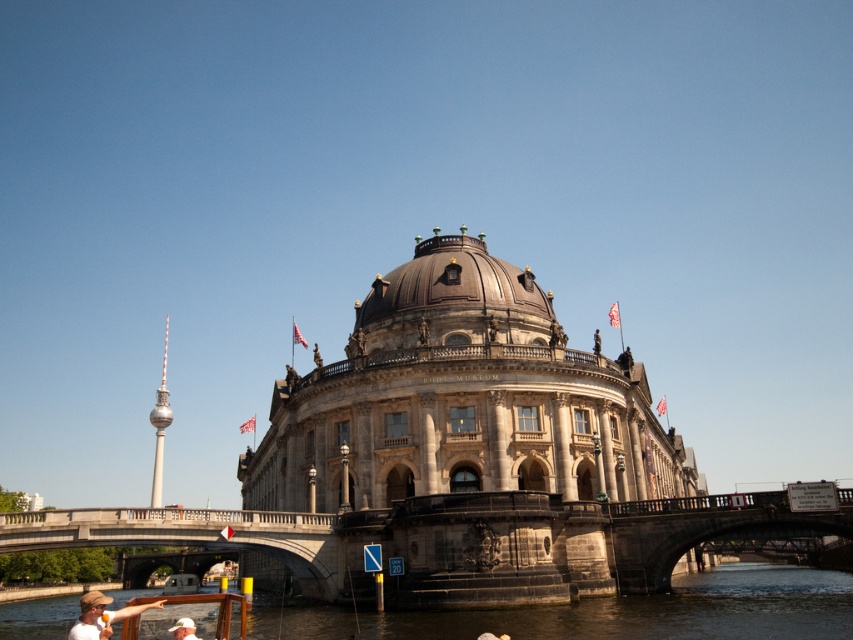
Question: From the image, what is the correct spatial relationship of dark blue water at lower center in relation to silver metallic tower at left?

Choices:
 (A) left
 (B) right

Answer: (B)

Question: Which point is closer to the camera?

Choices:
 (A) (585, 557)
 (B) (122, 616)

Answer: (B)

Question: Among these points, which one is nearest to the camera?

Choices:
 (A) (491, 595)
 (B) (440, 269)
 (C) (721, 625)
 (D) (175, 625)

Answer: (C)

Question: Is stone bridge at lower center smaller than dark blue water at lower center?

Choices:
 (A) no
 (B) yes

Answer: (B)

Question: Does stone bridge at lower center appear on the right side of dark blue water at lower center?

Choices:
 (A) yes
 (B) no

Answer: (A)

Question: Based on their relative distances, which object is nearer to the silver metallic tower at left?

Choices:
 (A) dark blue water at lower center
 (B) matte white shirt at lower left
 (C) stone bridge at lower center
 (D) white fabric hat at lower center

Answer: (B)